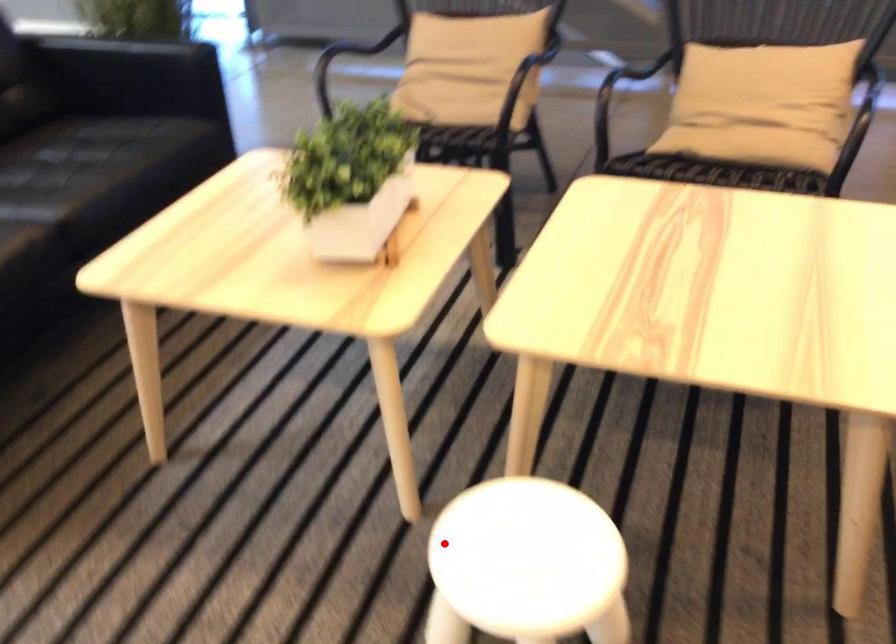
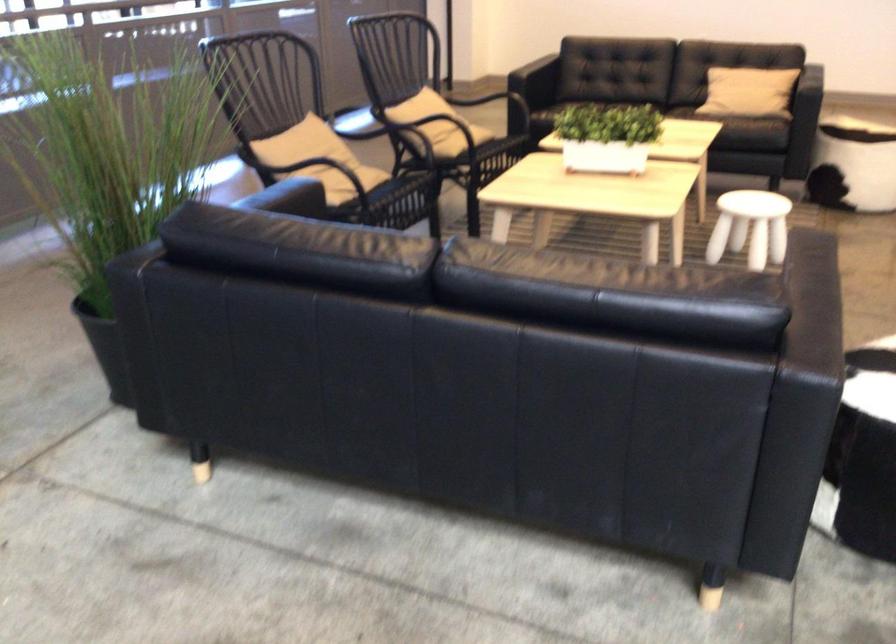
In the second image, find the point that corresponds to the highlighted location in the first image.

(750, 227)